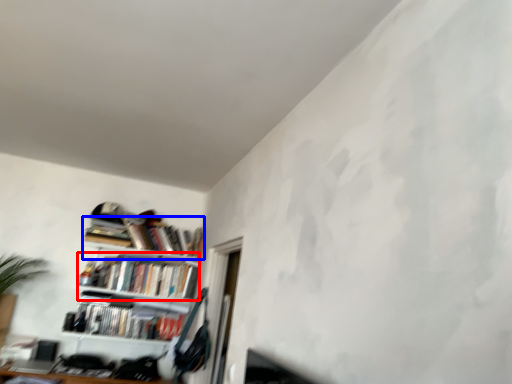
Question: Which object is further to the camera taking this photo, book (highlighted by a red box) or book (highlighted by a blue box)?

Choices:
 (A) book
 (B) book

Answer: (B)